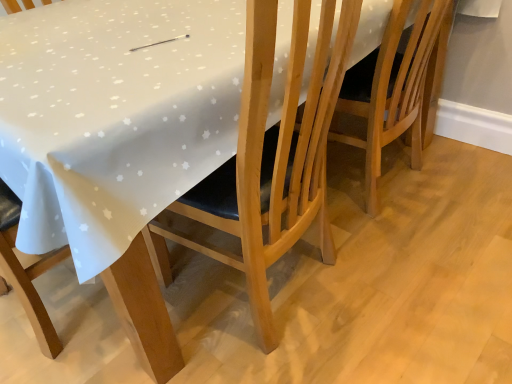
Question: Considering the relative sizes of light brown wooden chair at center, acting as the second chair starting from the left, and wooden chair at center, acting as the 1th chair starting from the left, in the image provided, is light brown wooden chair at center, acting as the second chair starting from the left, smaller than wooden chair at center, acting as the 1th chair starting from the left,?

Choices:
 (A) yes
 (B) no

Answer: (A)

Question: Is the position of light brown wooden chair at center, which ranks as the first chair in right-to-left order, less distant than that of wooden chair at center, which ranks as the 2th chair in right-to-left order?

Choices:
 (A) no
 (B) yes

Answer: (A)

Question: Is light brown wooden chair at center, acting as the second chair starting from the left, at the left side of wooden chair at center, which ranks as the 2th chair in right-to-left order?

Choices:
 (A) yes
 (B) no

Answer: (B)

Question: Can you confirm if light brown wooden chair at center, which ranks as the first chair in right-to-left order, is bigger than wooden chair at center, acting as the 1th chair starting from the left?

Choices:
 (A) yes
 (B) no

Answer: (B)

Question: Does light brown wooden chair at center, acting as the second chair starting from the left, have a lesser width compared to wooden chair at center, acting as the 1th chair starting from the left?

Choices:
 (A) yes
 (B) no

Answer: (B)

Question: Is light brown wooden chair at center, which ranks as the first chair in right-to-left order, positioned beyond the bounds of wooden chair at center, which ranks as the 2th chair in right-to-left order?

Choices:
 (A) yes
 (B) no

Answer: (A)

Question: From a real-world perspective, is wooden chair at center, which ranks as the 2th chair in right-to-left order, physically above light brown wooden chair at center, acting as the second chair starting from the left?

Choices:
 (A) no
 (B) yes

Answer: (B)

Question: Can you confirm if wooden chair at center, which ranks as the 2th chair in right-to-left order, is shorter than light brown wooden chair at center, acting as the second chair starting from the left?

Choices:
 (A) yes
 (B) no

Answer: (B)

Question: Does wooden chair at center, which ranks as the 2th chair in right-to-left order, turn towards light brown wooden chair at center, acting as the second chair starting from the left?

Choices:
 (A) yes
 (B) no

Answer: (B)

Question: Is the surface of wooden chair at center, which ranks as the 2th chair in right-to-left order, in direct contact with light brown wooden chair at center, acting as the second chair starting from the left?

Choices:
 (A) yes
 (B) no

Answer: (B)

Question: Is wooden chair at center, which ranks as the 2th chair in right-to-left order, bigger than light brown wooden chair at center, acting as the second chair starting from the left?

Choices:
 (A) yes
 (B) no

Answer: (A)

Question: Is wooden chair at center, acting as the 1th chair starting from the left, smaller than light brown wooden chair at center, which ranks as the first chair in right-to-left order?

Choices:
 (A) yes
 (B) no

Answer: (B)

Question: From a real-world perspective, is light brown wooden chair at center, which ranks as the first chair in right-to-left order, positioned above or below wooden chair at center, acting as the 1th chair starting from the left?

Choices:
 (A) above
 (B) below

Answer: (B)